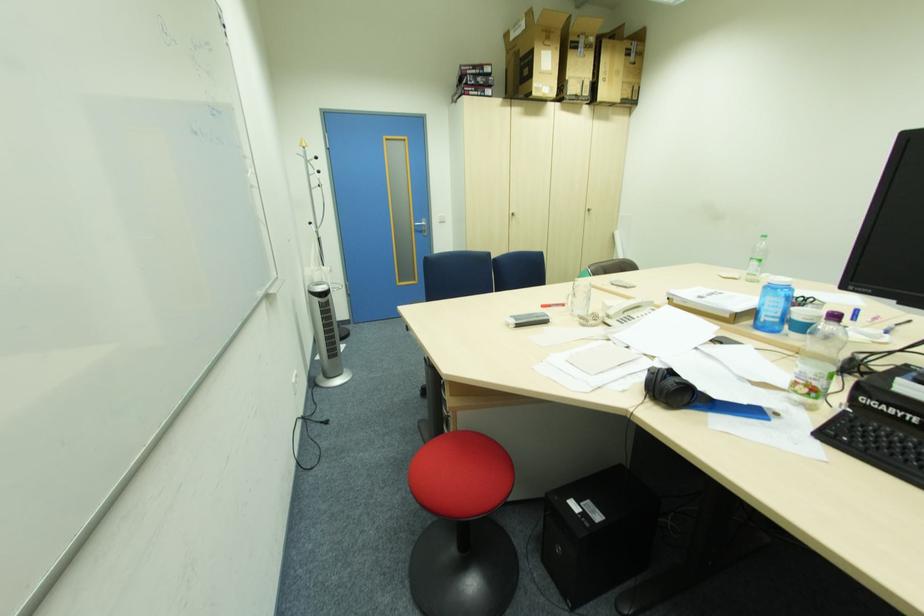
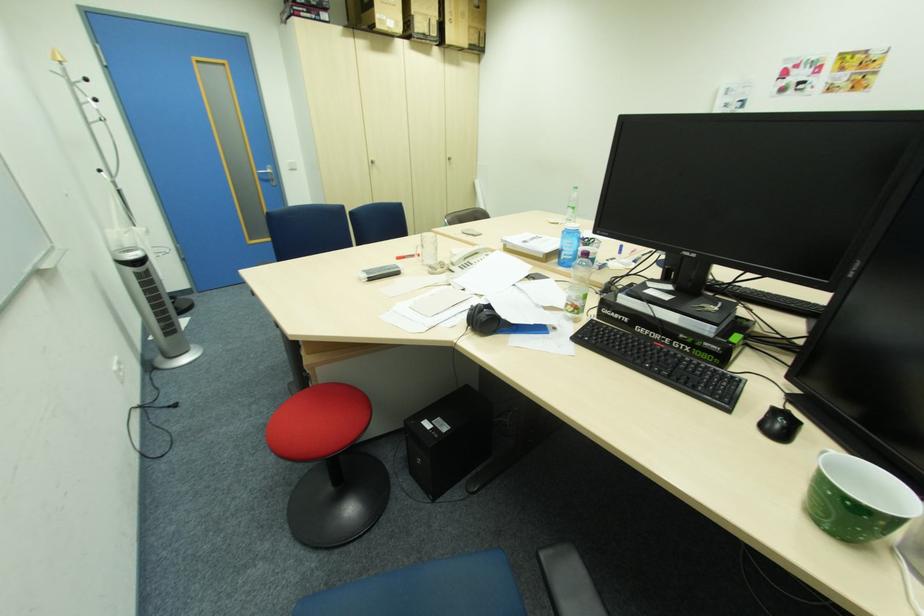
The point at (416, 437) is marked in the first image. Where is the corresponding point in the second image?

(285, 400)